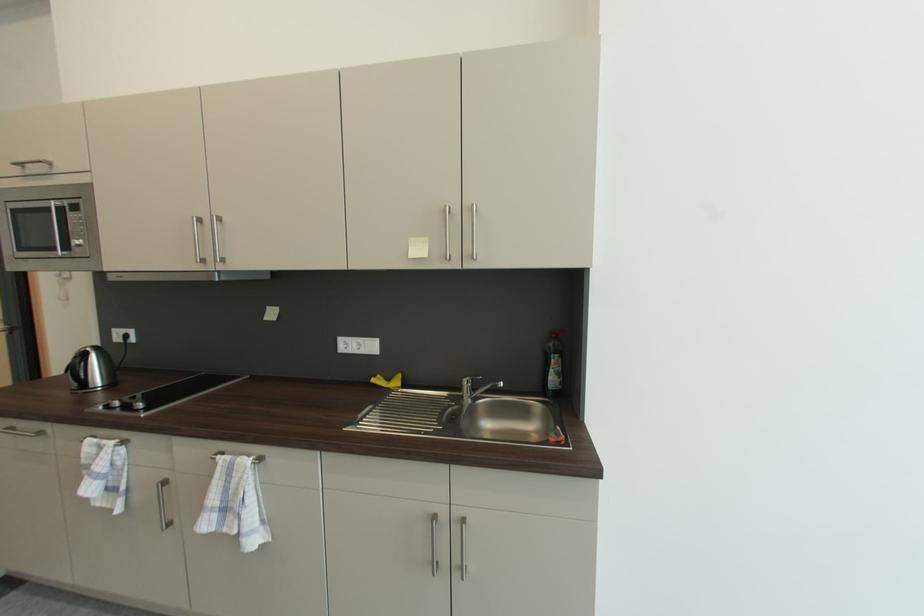
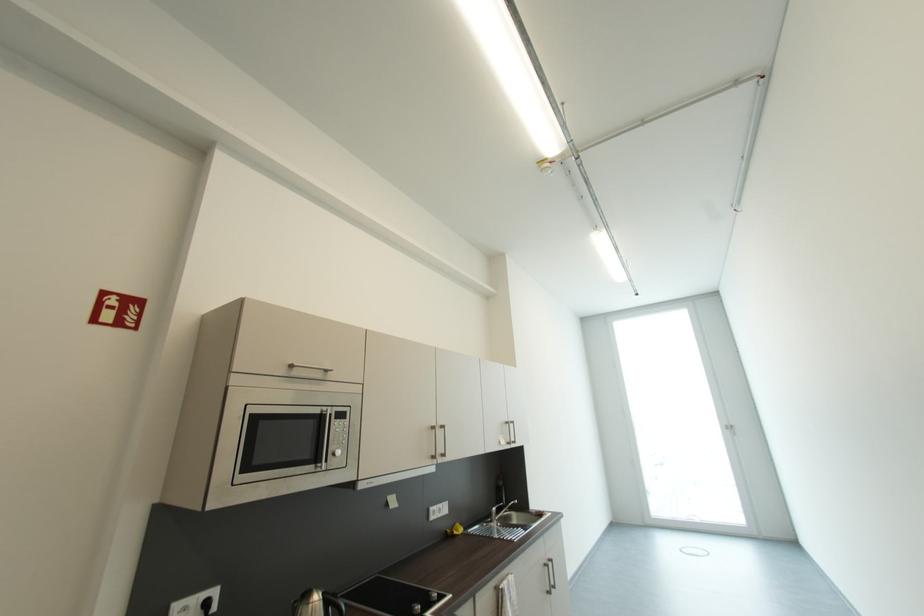
Where in the second image is the point corresponding to point (28, 168) from the first image?

(298, 368)